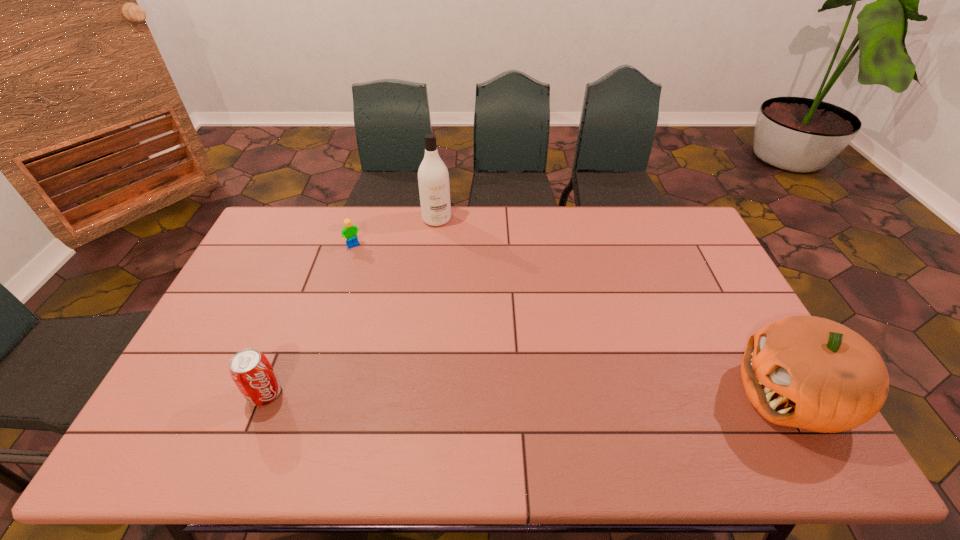
You are a GUI agent. You are given a task and a screenshot of the screen. Output one action in this format:
    pyautogui.click(x=<x>, y=<y>)
    Task: Click on the leftmost object
    This screenshot has width=960, height=540.
    Given the screenshot: What is the action you would take?
    pyautogui.click(x=251, y=371)

You are a GUI agent. You are given a task and a screenshot of the screen. Output one action in this format:
    pyautogui.click(x=<x>, y=<y>)
    Task: Click on the third tallest object
    The image size is (960, 540).
    Given the screenshot: What is the action you would take?
    pyautogui.click(x=251, y=371)

Where is `the third shortest object`? The height and width of the screenshot is (540, 960). the third shortest object is located at coordinates 807,372.

I want to click on the rightmost object, so click(807, 372).

This screenshot has width=960, height=540. Find the location of `the third nearest object`. the third nearest object is located at coordinates (349, 232).

The width and height of the screenshot is (960, 540). Identify the location of Lego. (349, 232).

The image size is (960, 540). Identify the location of the tallest object. (433, 179).

Where is `the third object from left to right`? This screenshot has height=540, width=960. the third object from left to right is located at coordinates (433, 179).

The height and width of the screenshot is (540, 960). Find the location of `vacant region located on the left of the soda`. vacant region located on the left of the soda is located at coordinates (222, 394).

Identify the location of vacant space situated 0.110m on the face of the rightmost object. This screenshot has width=960, height=540. (694, 395).